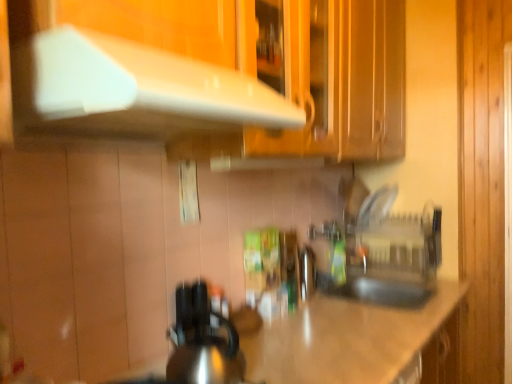
Question: Considering their positions, is white glossy exhaust hood at upper center located in front of or behind shiny metallic countertop at center?

Choices:
 (A) behind
 (B) front

Answer: (B)

Question: Considering the relative positions of white glossy exhaust hood at upper center and shiny metallic countertop at center in the image provided, is white glossy exhaust hood at upper center to the left or to the right of shiny metallic countertop at center?

Choices:
 (A) left
 (B) right

Answer: (A)

Question: Based on their relative distances, which object is farther from the shiny metallic kettle at center?

Choices:
 (A) shiny metallic countertop at center
 (B) white glossy exhaust hood at upper center
 (C) transparent plastic sink at center
 (D) green matte bottle at center

Answer: (C)

Question: Which object is positioned closest to the white glossy exhaust hood at upper center?

Choices:
 (A) transparent plastic sink at center
 (B) green matte bottle at center
 (C) shiny metallic kettle at center
 (D) shiny metallic countertop at center

Answer: (C)